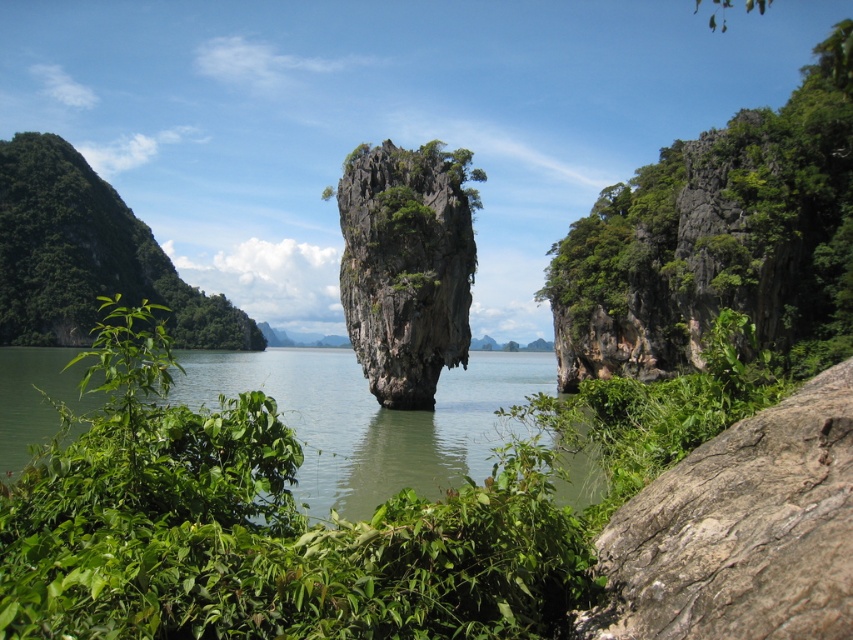
Is green leafy rock at right above green mossy rock at center?

Yes.

Is green leafy rock at right to the left of green mossy rock at center from the viewer's perspective?

Incorrect, green leafy rock at right is not on the left side of green mossy rock at center.

Image resolution: width=853 pixels, height=640 pixels. I want to click on green leafy rock at right, so click(x=718, y=240).

Locate an element on the screen. This screenshot has width=853, height=640. green leafy rock at right is located at coordinates (718, 240).

Looking at this image, does green leafy rock at right appear on the right side of green water at center?

Result: Yes, green leafy rock at right is to the right of green water at center.

Between point (656, 340) and point (297, 364), which one is positioned behind?

Point (297, 364)

This screenshot has width=853, height=640. Identify the location of green leafy rock at right. (718, 240).

Does point (653, 173) come in front of point (241, 323)?

Yes, point (653, 173) is closer to viewer.

Which is more to the right, green leafy rock at right or green leafy shrub at left?

Positioned to the right is green leafy rock at right.

Does point (669, 266) come behind point (18, 182)?

No.

At what (x,y) coordinates should I click in order to perform the action: click on green leafy rock at right. Please return your answer as a coordinate pair (x, y). The width and height of the screenshot is (853, 640). Looking at the image, I should click on (718, 240).